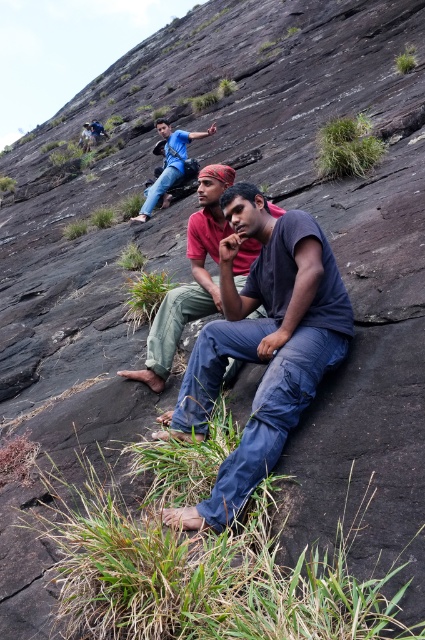
Question: Which point is closer to the camera?

Choices:
 (A) dark blue cotton shirt at center
 (B) dark blue jeans at center

Answer: (A)

Question: Which object is farther from the camera taking this photo?

Choices:
 (A) dark blue cotton shirt at center
 (B) dark blue jeans at center

Answer: (B)

Question: Is dark blue cotton shirt at center positioned in front of dark blue jeans at center?

Choices:
 (A) yes
 (B) no

Answer: (A)

Question: Is dark blue cotton shirt at center positioned before dark blue jeans at center?

Choices:
 (A) no
 (B) yes

Answer: (B)

Question: Which point is closer to the camera taking this photo?

Choices:
 (A) (320, 317)
 (B) (206, 209)

Answer: (A)

Question: Is dark blue cotton shirt at center positioned at the back of dark blue jeans at center?

Choices:
 (A) yes
 (B) no

Answer: (B)